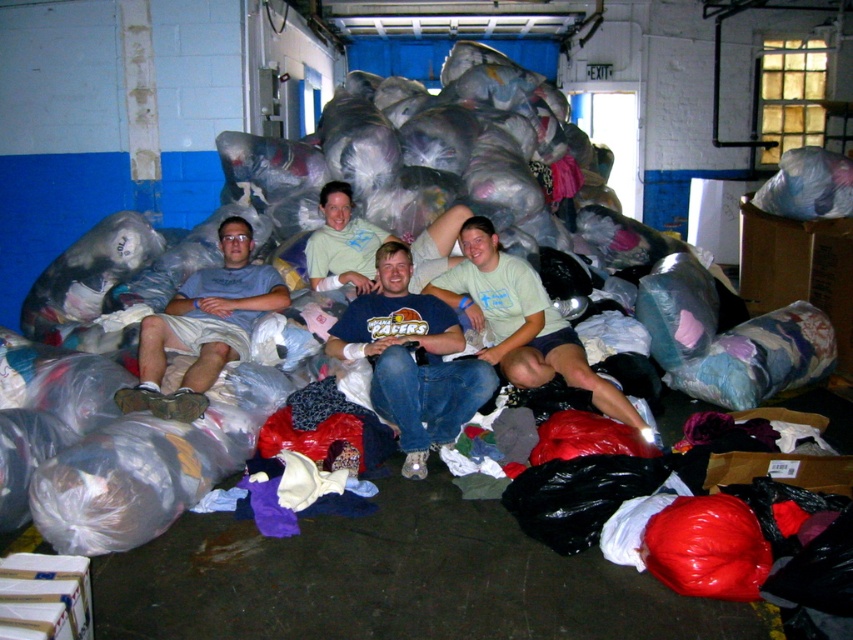
Is point (227, 333) closer to camera compared to point (426, 228)?

Yes.

Is point (223, 294) farther from viewer compared to point (346, 244)?

No, it is not.

Identify the location of matte gray t-shirt at center. The width and height of the screenshot is (853, 640). (204, 326).

You are a GUI agent. You are given a task and a screenshot of the screen. Output one action in this format:
    pyautogui.click(x=<x>, y=<y>)
    Task: Click on the matte gray t-shirt at center
    The width and height of the screenshot is (853, 640).
    Given the screenshot: What is the action you would take?
    pyautogui.click(x=204, y=326)

Does point (279, 288) come in front of point (584, 385)?

No, (279, 288) is further to viewer.

Where is `matte gray t-shirt at center`? matte gray t-shirt at center is located at coordinates (204, 326).

Is blue cotton t-shirt at center smaller than matte gray t-shirt at center?

Indeed, blue cotton t-shirt at center has a smaller size compared to matte gray t-shirt at center.

Does blue cotton t-shirt at center lie behind matte gray t-shirt at center?

That is True.

This screenshot has width=853, height=640. I want to click on blue cotton t-shirt at center, so click(410, 358).

Image resolution: width=853 pixels, height=640 pixels. Identify the location of blue cotton t-shirt at center. (410, 358).